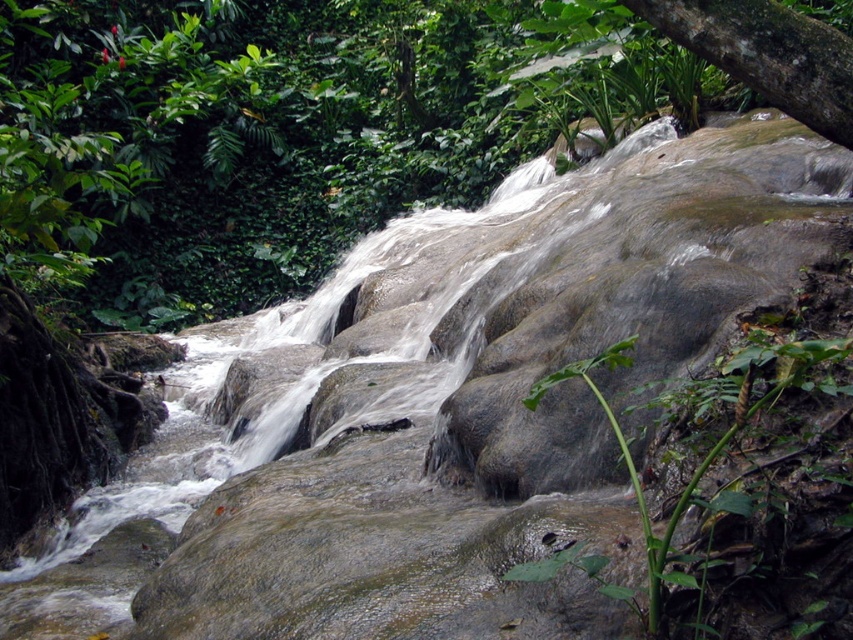
You are standing at the center of the stream and want to reach the green rough bark tree at upper right. Which direction should you head towards?

The green rough bark tree at upper right is located at point (767, 54), so you should head towards the upper right direction to reach it.

You are a hiker who wants to place a 24 inch wide backpack between the green rough bark tree at upper right and the green leafy plant at lower center. Can you fit it there?

The distance between the green rough bark tree at upper right and the green leafy plant at lower center is 26.55 inches. Since the backpack is 24 inches wide, it can fit between them as there is enough space.

You are standing at the edge of the stream and see two points marked in the scene. Which point is closer to you, point (679, 22) or point (828, 356)?

Point (828, 356) is closer to you because it is less further to the camera than point (679, 22).